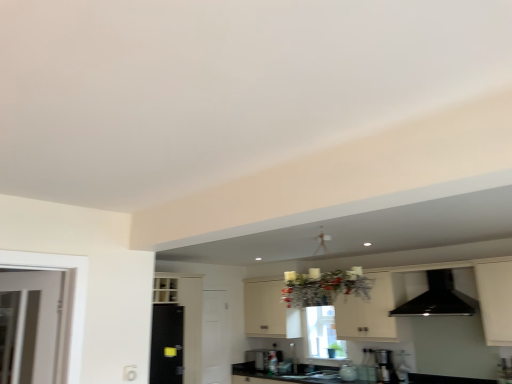
What do you see at coordinates (215, 338) in the screenshot? The width and height of the screenshot is (512, 384). I see `white matte door at center` at bounding box center [215, 338].

The height and width of the screenshot is (384, 512). What do you see at coordinates (431, 269) in the screenshot? I see `white matte cabinet at center` at bounding box center [431, 269].

This screenshot has height=384, width=512. Identify the location of black granite countertop at lower center. (289, 375).

What is the approximate width of black glossy sink at center, placed as the first sink when sorted from bottom to top?

15.91 inches.

Where is `satin silver coffee machine at lower right`? This screenshot has width=512, height=384. satin silver coffee machine at lower right is located at coordinates (384, 366).

The width and height of the screenshot is (512, 384). I want to click on black glossy exhaust hood at upper right, so click(438, 299).

Consider the image. Is black glossy exhaust hood at upper right next to black granite countertop at lower center?

No, black glossy exhaust hood at upper right is not beside black granite countertop at lower center.

From a real-world perspective, which object rests below the other?

black granite countertop at lower center.

Which point is more forward, (444, 278) or (306, 375)?

Point (444, 278)

Would you say black glossy exhaust hood at upper right is to the left or to the right of black granite countertop at lower center in the picture?

black glossy exhaust hood at upper right is to the right of black granite countertop at lower center.

Is black glossy exhaust hood at upper right not near white matte cabinet at center?

No, black glossy exhaust hood at upper right is not far from white matte cabinet at center.

Which is closer, (410, 313) or (504, 265)?

The point (504, 265) is more forward.

Which is more to the right, black glossy exhaust hood at upper right or white matte cabinet at center?

Positioned to the right is black glossy exhaust hood at upper right.

Find the location of a particular element. exhaust hood that is behind the white matte cabinet at center is located at coordinates click(x=438, y=299).

How different are the orientations of metallic silver toaster at center and black glossy exhaust hood at upper right in degrees?

The facing directions of metallic silver toaster at center and black glossy exhaust hood at upper right are 1.74 degrees apart.

Is metallic silver toaster at center next to black glossy exhaust hood at upper right and touching it?

metallic silver toaster at center is not next to black glossy exhaust hood at upper right, and they're not touching.

Can you confirm if metallic silver toaster at center is positioned to the right of black glossy exhaust hood at upper right?

In fact, metallic silver toaster at center is to the left of black glossy exhaust hood at upper right.

From a real-world perspective, is white matte cabinet at center above or below black glossy sink at center, placed as the first sink when sorted from bottom to top?

In terms of real-world spatial position, white matte cabinet at center is above black glossy sink at center, placed as the first sink when sorted from bottom to top.

Can you tell me how much white matte cabinet at center and black glossy sink at center, which is the second sink from top to bottom, differ in facing direction?

The angular difference between white matte cabinet at center and black glossy sink at center, which is the second sink from top to bottom, is 1.07 degrees.

Does white matte cabinet at center have a lesser height compared to black glossy sink at center, placed as the first sink when sorted from bottom to top?

In fact, white matte cabinet at center may be taller than black glossy sink at center, placed as the first sink when sorted from bottom to top.

Is white matte cabinet at center aimed at black glossy sink at center, placed as the first sink when sorted from bottom to top?

No, white matte cabinet at center does not turn towards black glossy sink at center, placed as the first sink when sorted from bottom to top.

Consider the image. How many degrees apart are the facing directions of black glossy sink at center, placed as the first sink when sorted from bottom to top, and black glossy sink at center, acting as the second sink starting from the bottom?

They differ by 1.89 degrees in their facing directions.

From the image's perspective, which is above, black glossy sink at center, which is the second sink from top to bottom, or black glossy sink at center, acting as the second sink starting from the bottom?

black glossy sink at center, acting as the second sink starting from the bottom, from the image's perspective.

Which is correct: black glossy sink at center, placed as the first sink when sorted from bottom to top, is inside black glossy sink at center, positioned as the first sink in top-to-bottom order, or outside of it?

black glossy sink at center, placed as the first sink when sorted from bottom to top, is spatially situated outside black glossy sink at center, positioned as the first sink in top-to-bottom order.

The width and height of the screenshot is (512, 384). I want to click on sink below the black glossy sink at center, positioned as the first sink in top-to-bottom order (from the image's perspective), so click(x=312, y=374).

Is black glossy exhaust hood at upper right not near white matte door at center?

That's right, there is a large distance between black glossy exhaust hood at upper right and white matte door at center.

In the scene shown: Is black glossy exhaust hood at upper right positioned beyond the bounds of white matte door at center?

That's correct, black glossy exhaust hood at upper right is outside of white matte door at center.

Does point (397, 309) come closer to viewer compared to point (209, 376)?

No, (397, 309) is further to viewer.

Who is bigger, black glossy exhaust hood at upper right or white matte door at center?

Bigger between the two is black glossy exhaust hood at upper right.

Can we say black glossy sink at center, positioned as the first sink in top-to-bottom order, lies outside metallic silver toaster at center?

Yes, black glossy sink at center, positioned as the first sink in top-to-bottom order, is not within metallic silver toaster at center.

Is black glossy sink at center, acting as the second sink starting from the bottom, closer to camera compared to metallic silver toaster at center?

Yes, black glossy sink at center, acting as the second sink starting from the bottom, is closer to the viewer.

From the picture: Could you measure the distance between black glossy sink at center, positioned as the first sink in top-to-bottom order, and metallic silver toaster at center?

The distance of black glossy sink at center, positioned as the first sink in top-to-bottom order, from metallic silver toaster at center is 28.21 inches.

Considering the points (330, 379) and (272, 363), which point is behind, point (330, 379) or point (272, 363)?

Positioned behind is point (272, 363).

The height and width of the screenshot is (384, 512). Find the location of `exhaust hood on the right side of black granite countertop at lower center`. exhaust hood on the right side of black granite countertop at lower center is located at coordinates (438, 299).

Find the location of a particular element. Image resolution: width=512 pixels, height=384 pixels. exhaust hood above the white matte cabinet at center (from the image's perspective) is located at coordinates (438, 299).

Which object lies nearer to the anchor point black glossy sink at center, placed as the first sink when sorted from bottom to top, white matte door at center or black granite countertop at lower center?

The object closer to black glossy sink at center, placed as the first sink when sorted from bottom to top, is black granite countertop at lower center.

From the image, which object appears to be nearer to black granite countertop at lower center, white matte door at center or metallic silver toaster at center?

Based on the image, metallic silver toaster at center appears to be nearer to black granite countertop at lower center.

In the scene shown: Which object lies further to the anchor point white matte cabinet at center, black glossy sink at center, positioned as the first sink in top-to-bottom order, or black granite countertop at lower center?

Based on the image, black granite countertop at lower center appears to be further to white matte cabinet at center.

Considering their positions, is black glossy sink at center, placed as the first sink when sorted from bottom to top, positioned closer to black glossy exhaust hood at upper right than black granite countertop at lower center?

black glossy sink at center, placed as the first sink when sorted from bottom to top, is closer to black glossy exhaust hood at upper right.

Estimate the real-world distances between objects in this image. Which object is further from white matte cabinet at center, metallic silver toaster at center or black granite countertop at lower center?

Based on the image, metallic silver toaster at center appears to be further to white matte cabinet at center.

Based on the photo, looking at the image, which one is located closer to black glossy sink at center, which is the second sink from top to bottom, black glossy exhaust hood at upper right or black glossy sink at center, acting as the second sink starting from the bottom?

black glossy sink at center, acting as the second sink starting from the bottom, is positioned closer to the anchor black glossy sink at center, which is the second sink from top to bottom.

Estimate the real-world distances between objects in this image. Which object is closer to metallic silver toaster at center, satin silver coffee machine at lower right or black granite countertop at lower center?

black granite countertop at lower center.

Looking at the image, which one is located further to metallic silver toaster at center, white matte cabinet at center or black glossy exhaust hood at upper right?

black glossy exhaust hood at upper right lies further to metallic silver toaster at center than the other object.

This screenshot has width=512, height=384. Find the location of `countertop between black glossy exhaust hood at upper right and metallic silver toaster at center along the z-axis`. countertop between black glossy exhaust hood at upper right and metallic silver toaster at center along the z-axis is located at coordinates click(x=289, y=375).

Identify the location of appliance located between white matte door at center and satin silver coffee machine at lower right in the left-right direction. (264, 359).

At what (x,y) coordinates should I click in order to perform the action: click on screen door between black granite countertop at lower center and metallic silver toaster at center from front to back. Please return your answer as a coordinate pair (x, y). The image size is (512, 384). Looking at the image, I should click on (215, 338).

Locate an element on the screen. coffee machine between black granite countertop at lower center and metallic silver toaster at center in the front-back direction is located at coordinates pyautogui.click(x=384, y=366).